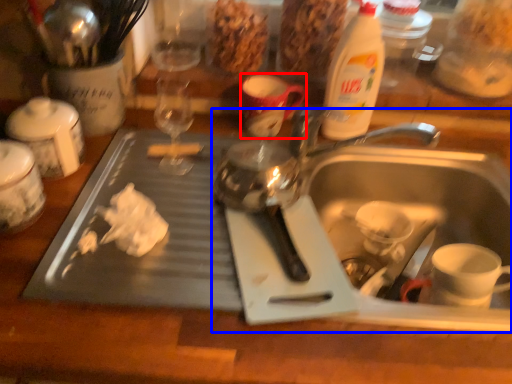
Question: Which object is closer to the camera taking this photo, mug (highlighted by a red box) or sink (highlighted by a blue box)?

Choices:
 (A) mug
 (B) sink

Answer: (B)